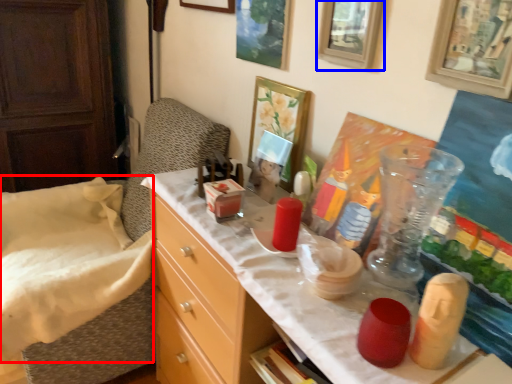
Question: Which point is further to the camera, sheet (highlighted by a red box) or picture frame (highlighted by a blue box)?

Choices:
 (A) sheet
 (B) picture frame

Answer: (A)